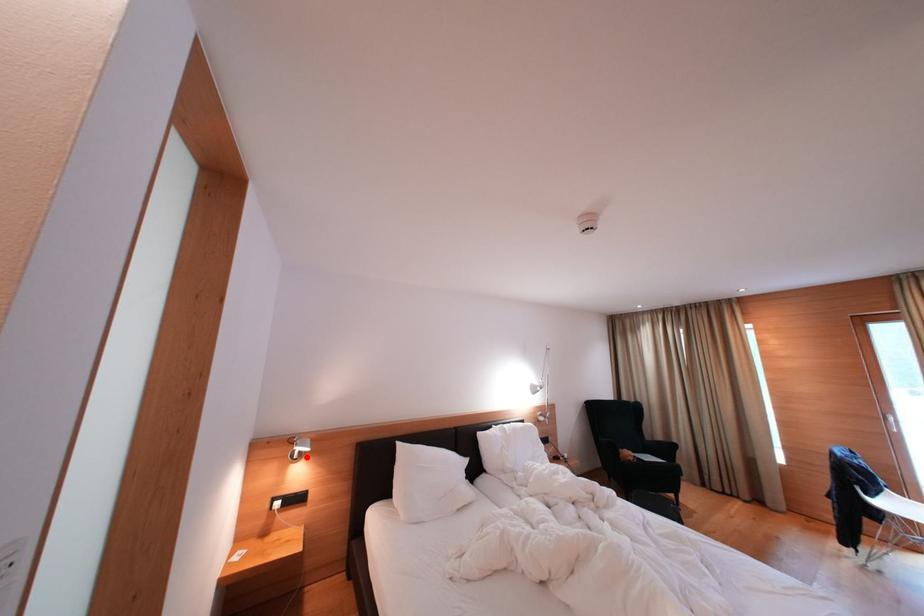
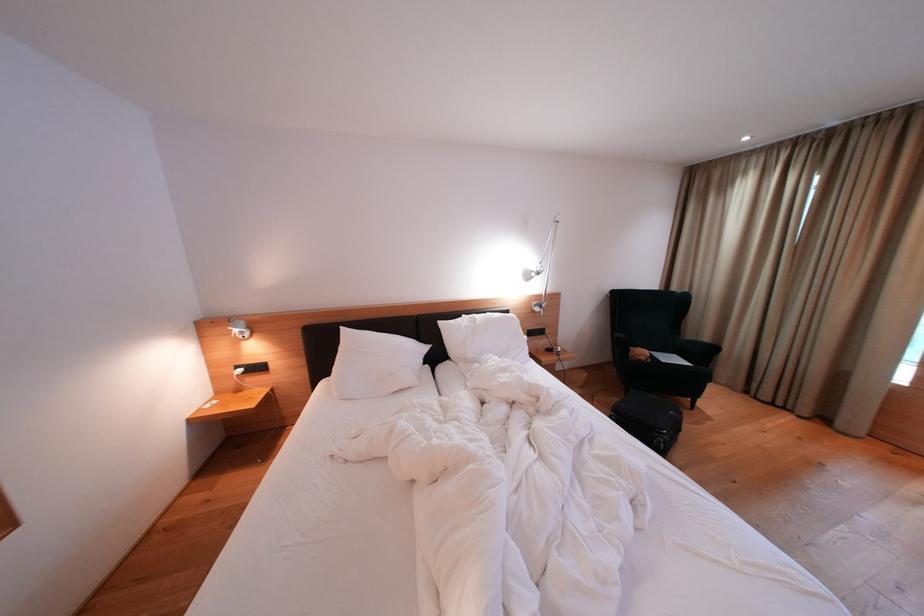
Locate, in the second image, the point that corresponds to the highlighted location in the first image.

(249, 336)